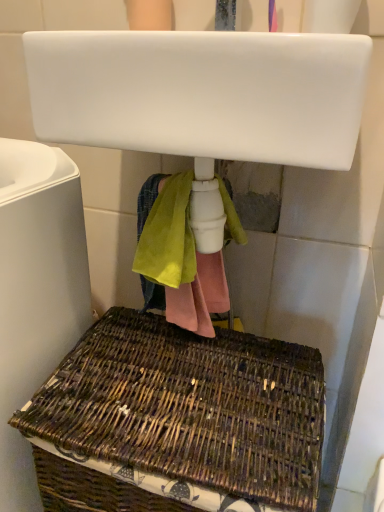
Question: Based on their sizes in the image, would you say white glossy sink at upper center is bigger or smaller than brown woven picnic basket at lower center?

Choices:
 (A) small
 (B) big

Answer: (A)

Question: Is white glossy sink at upper center to the left or to the right of brown woven picnic basket at lower center in the image?

Choices:
 (A) right
 (B) left

Answer: (A)

Question: Which of these objects is positioned farthest from the woven brown basket at lower left?

Choices:
 (A) white glossy sink at upper center
 (B) brown woven picnic basket at lower center

Answer: (A)

Question: Which object is the closest to the white glossy sink at upper center?

Choices:
 (A) woven brown basket at lower left
 (B) brown woven picnic basket at lower center

Answer: (A)